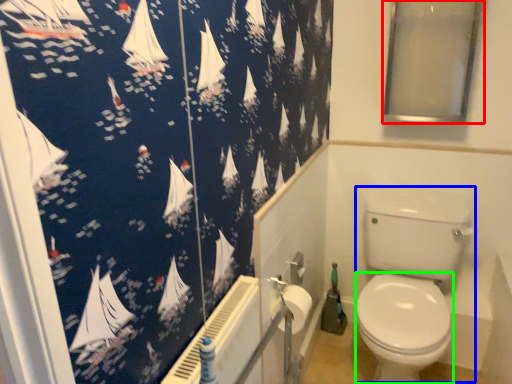
Question: Which object is positioned farthest from window screen (highlighted by a red box)? Select from toilet bowl (highlighted by a blue box) and bidet (highlighted by a green box).

Choices:
 (A) toilet bowl
 (B) bidet

Answer: (B)